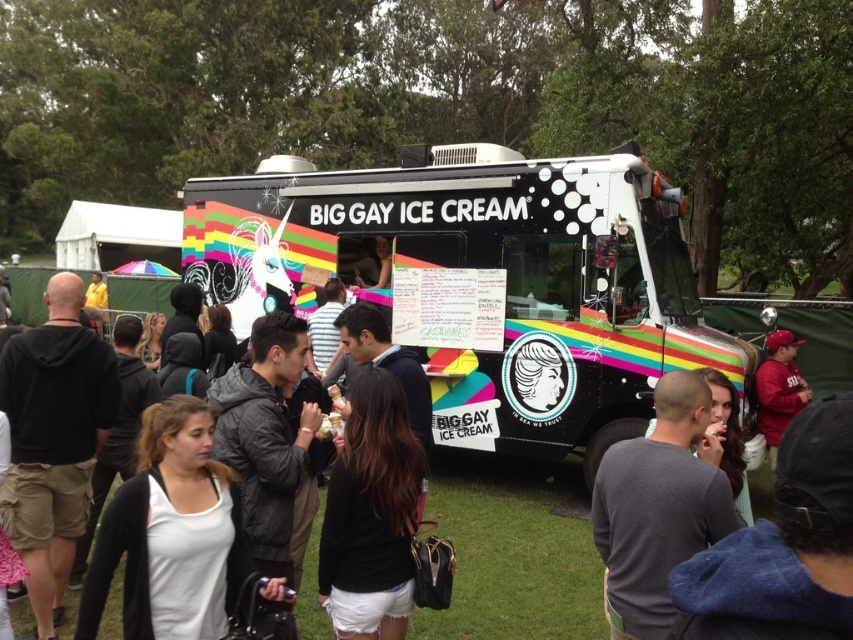
You are a photographer trying to capture a photo of the rainbow painted ice cream truck at center and the matte black jacket at center. If you want to ensure both objects are in the frame without cropping, which object should you focus on to frame the shot appropriately?

The rainbow painted ice cream truck at center has a lesser width compared to matte black jacket at center, so you should focus on framing the wider matte black jacket at center to ensure both fit in the shot.

You are standing at the entrance of the park and want to locate the rainbow painted ice cream truck at center. According to the map coordinates, where should you look?

The rainbow painted ice cream truck at center is located at point [480,282].

You are standing in front of the rainbow painted ice cream truck at center and want to hand a flyer to the person wearing the matte black jacket at center. Can you reach them directly without moving closer?

The rainbow painted ice cream truck at center is further away than the matte black jacket at center, so you can reach them directly without moving closer.